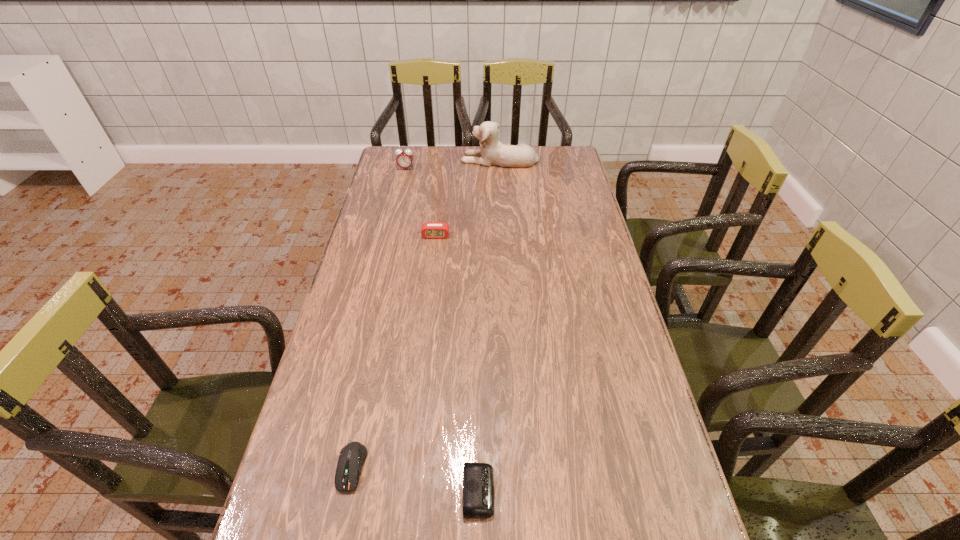
The height and width of the screenshot is (540, 960). Find the location of `vacant point located on the front-facing side of the puppy`. vacant point located on the front-facing side of the puppy is located at coordinates (430, 159).

Where is `vacant space positioned 0.330m on the clock face of the fourth shortest object`? Image resolution: width=960 pixels, height=540 pixels. vacant space positioned 0.330m on the clock face of the fourth shortest object is located at coordinates (394, 218).

Identify the location of vacant space situated on the front-facing side of the third object from right to left. The image size is (960, 540). (425, 325).

Find the location of `vacant region located 0.080m on the button of the computer equipment`. vacant region located 0.080m on the button of the computer equipment is located at coordinates (337, 537).

Where is `vacant position located on the display of the shortest object`? vacant position located on the display of the shortest object is located at coordinates (620, 491).

Locate an element on the screen. puppy present at the far edge is located at coordinates (493, 152).

Where is `alarm clock at the far edge`? This screenshot has width=960, height=540. alarm clock at the far edge is located at coordinates (x=404, y=159).

In order to click on alarm clock situated at the left edge in this screenshot , I will do `click(404, 159)`.

This screenshot has height=540, width=960. Find the location of `computer equipment that is at the left edge`. computer equipment that is at the left edge is located at coordinates (352, 456).

This screenshot has height=540, width=960. I want to click on object present at the right edge, so click(x=493, y=152).